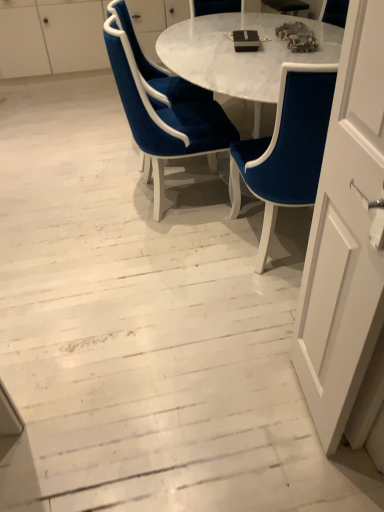
Identify the location of free space to the left of velvet blue chair at center, acting as the 2th chair starting from the right. (79, 199).